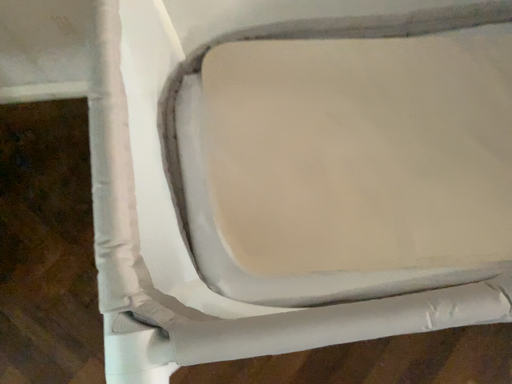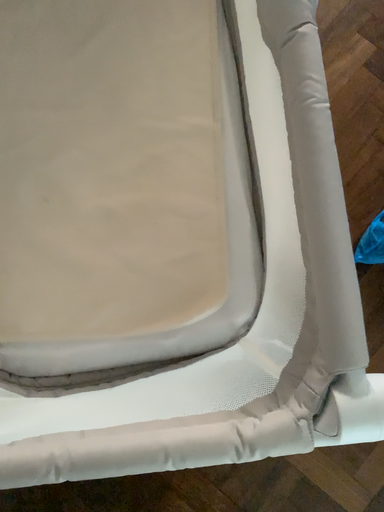
Question: How did the camera likely rotate when shooting the video?

Choices:
 (A) rotated left
 (B) rotated right

Answer: (B)